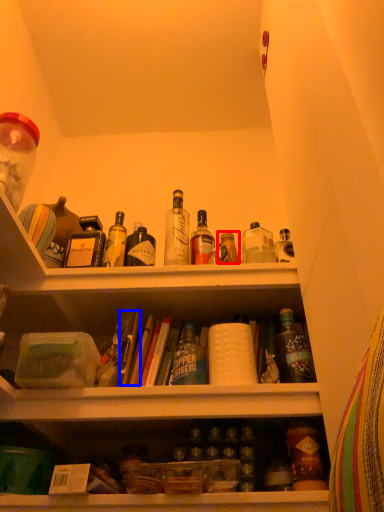
Question: Which of the following is the farthest to the observer, bottle (highlighted by a red box) or book (highlighted by a blue box)?

Choices:
 (A) bottle
 (B) book

Answer: (A)